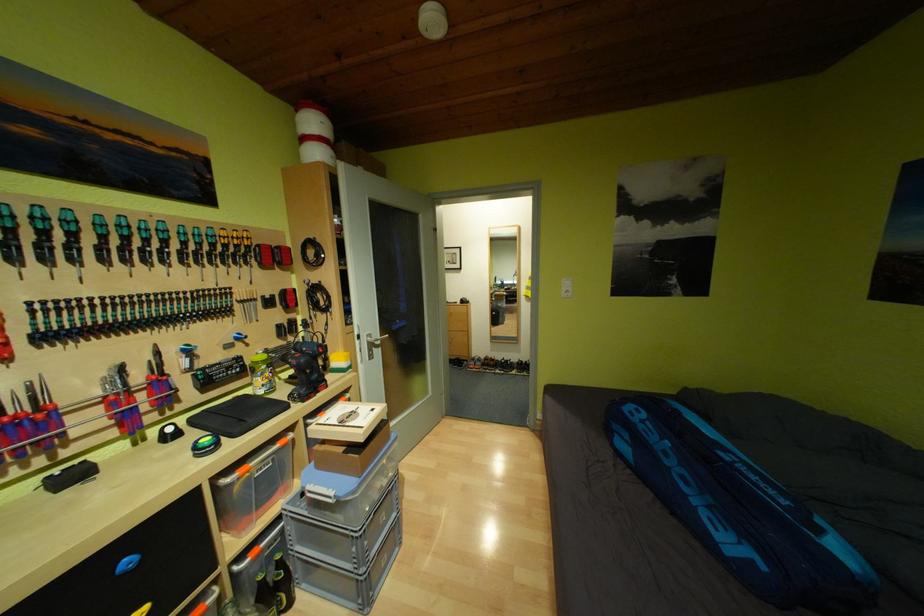
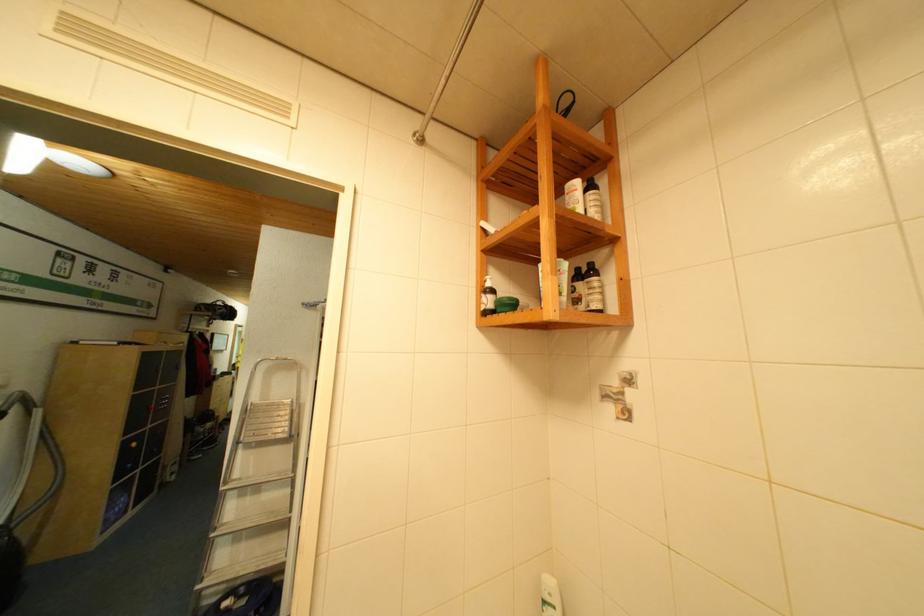
Question: I am providing you with two images of the same scene from different viewpoints. Which of the following objects are not visible in image2?

Choices:
 (A) small yellow figurine
 (B) sofa sitting surface
 (C) white cosmetic bottle
 (D) dark brown bottle

Answer: (B)